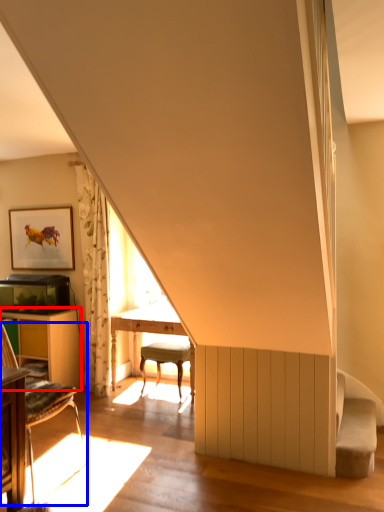
Question: Which object appears closest to the camera in this image, table (highlighted by a red box) or chair (highlighted by a blue box)?

Choices:
 (A) table
 (B) chair

Answer: (B)